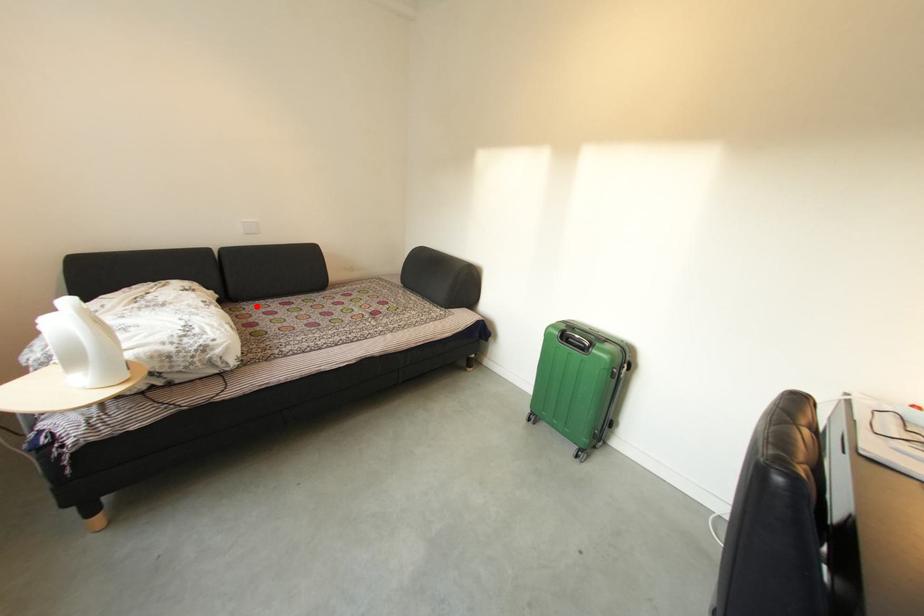
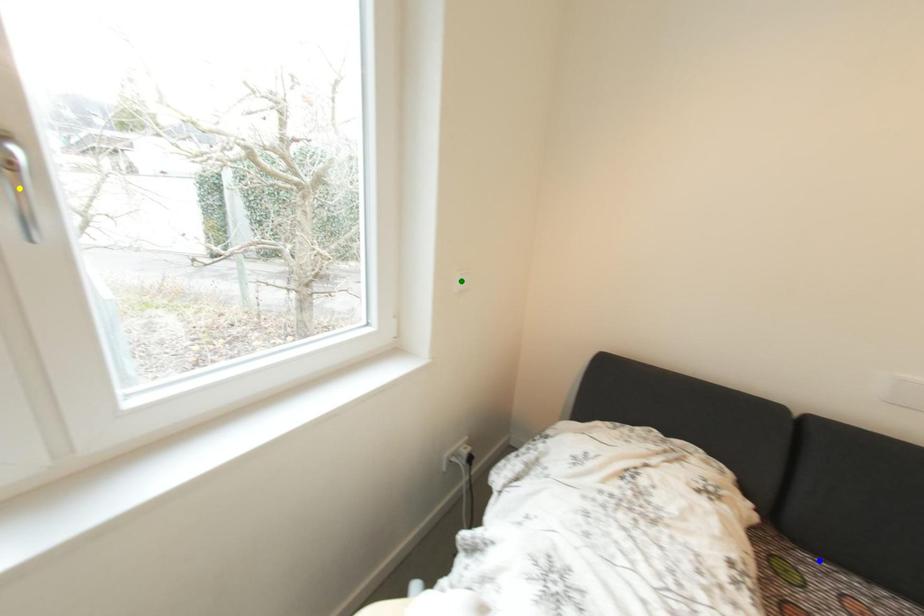
Question: I am providing you with two images of the same scene from different viewpoints. A red point is marked on the first image. You are given multiple points on the second image. Which point in image 2 represents the same 3d spot as the red point in image 1?

Choices:
 (A) yellow point
 (B) blue point
 (C) green point

Answer: (B)